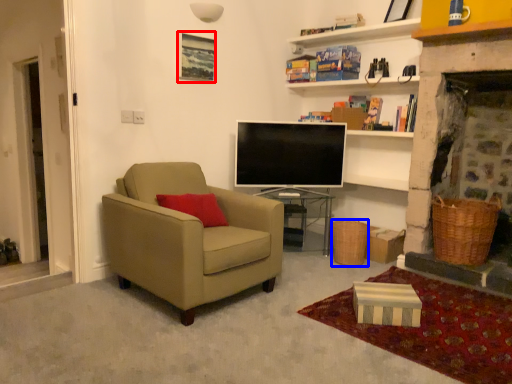
Question: Which of the following is the farthest to the observer, picture frame (highlighted by a red box) or picnic basket (highlighted by a blue box)?

Choices:
 (A) picture frame
 (B) picnic basket

Answer: (B)